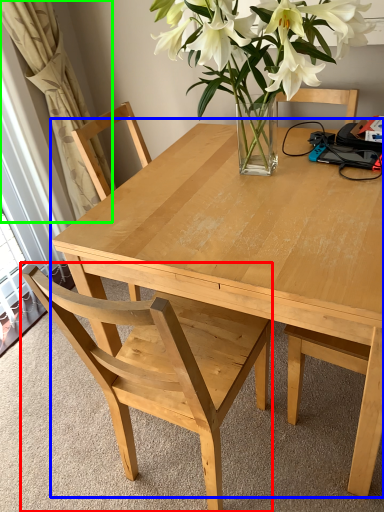
Question: Considering the real-world distances, which object is farthest from chair (highlighted by a red box)? kitchen & dining room table (highlighted by a blue box) or curtain (highlighted by a green box)?

Choices:
 (A) kitchen & dining room table
 (B) curtain

Answer: (B)